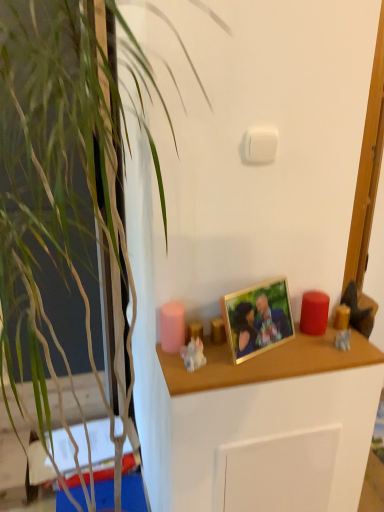
Where is `vacant region in front of red matte candle at right, the second candle viewed from the left`? The image size is (384, 512). vacant region in front of red matte candle at right, the second candle viewed from the left is located at coordinates (317, 351).